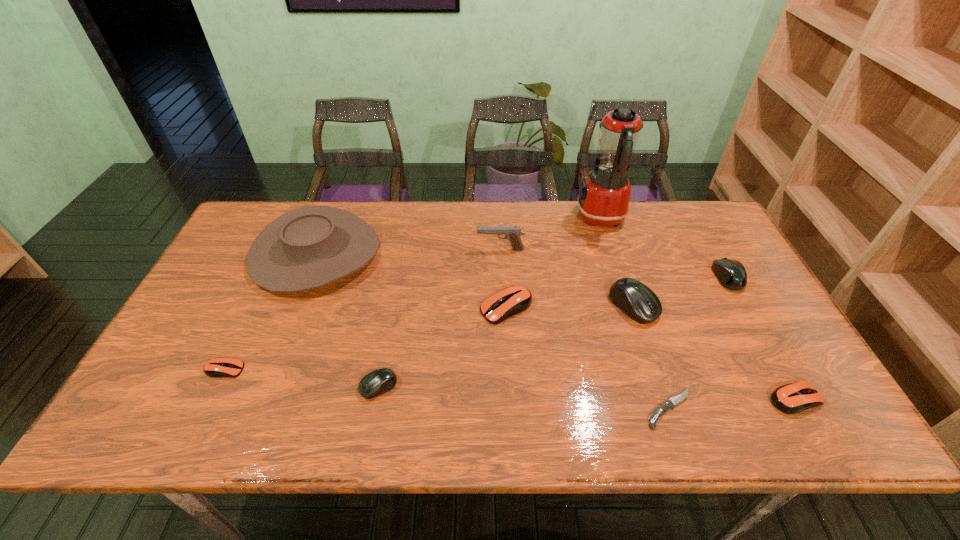
Locate an element on the screen. The width and height of the screenshot is (960, 540). the tallest object is located at coordinates (603, 200).

You are a GUI agent. You are given a task and a screenshot of the screen. Output one action in this format:
    pyautogui.click(x=<x>, y=<y>)
    Task: Click on the cowboy hat
    
    Given the screenshot: What is the action you would take?
    pyautogui.click(x=307, y=248)

You are a GUI agent. You are given a task and a screenshot of the screen. Output one action in this format:
    pyautogui.click(x=<x>, y=<y>)
    Task: Click on the pistol
    
    Given the screenshot: What is the action you would take?
    coord(512,233)

Image resolution: width=960 pixels, height=540 pixels. What are the coordinates of `the fourth computer mouse from left to right` in the screenshot? It's located at (635, 299).

Image resolution: width=960 pixels, height=540 pixels. I want to click on the seventh shortest object, so click(x=635, y=299).

The width and height of the screenshot is (960, 540). I want to click on the second biggest black mouse, so click(731, 274).

At what (x,y) coordinates should I click in order to perform the action: click on the second tallest computer mouse. Please return your answer as a coordinate pair (x, y). This screenshot has height=540, width=960. Looking at the image, I should click on (731, 274).

You are a GUI agent. You are given a task and a screenshot of the screen. Output one action in this format:
    pyautogui.click(x=<x>, y=<y>)
    Task: Click on the biggest orange computer mouse
    This screenshot has height=540, width=960.
    Given the screenshot: What is the action you would take?
    pyautogui.click(x=512, y=300)

Find the location of a particular element. the fourth computer mouse from right to left is located at coordinates (512, 300).

Image resolution: width=960 pixels, height=540 pixels. I want to click on the smallest black mouse, so click(x=379, y=381).